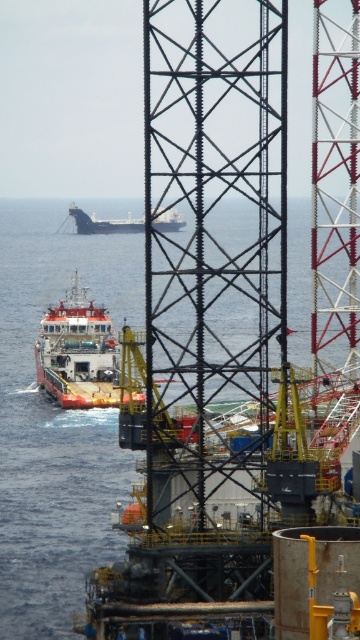
Which is above, white matte ship at center or white matte cargo ship at center?

white matte cargo ship at center is above.

Is white matte ship at center closer to camera compared to white matte cargo ship at center?

No, white matte ship at center is further to the viewer.

Identify the location of white matte ship at center. (78, 353).

Does blue water at center have a larger size compared to white matte ship at center?

Indeed, blue water at center has a larger size compared to white matte ship at center.

Does point (2, 433) come behind point (77, 392)?

That is False.

Does point (290, 262) lie behind point (66, 349)?

No, it is not.

At what (x,y) coordinates should I click in order to perform the action: click on blue water at center. Please return your answer as a coordinate pair (x, y). Looking at the image, I should click on (56, 422).

Can you confirm if blue water at center is smaller than white matte cargo ship at center?

Actually, blue water at center might be larger than white matte cargo ship at center.

Who is shorter, blue water at center or white matte cargo ship at center?

white matte cargo ship at center

Describe the element at coordinates (56, 422) in the screenshot. Image resolution: width=360 pixels, height=640 pixels. I see `blue water at center` at that location.

The width and height of the screenshot is (360, 640). Identify the location of blue water at center. (56, 422).